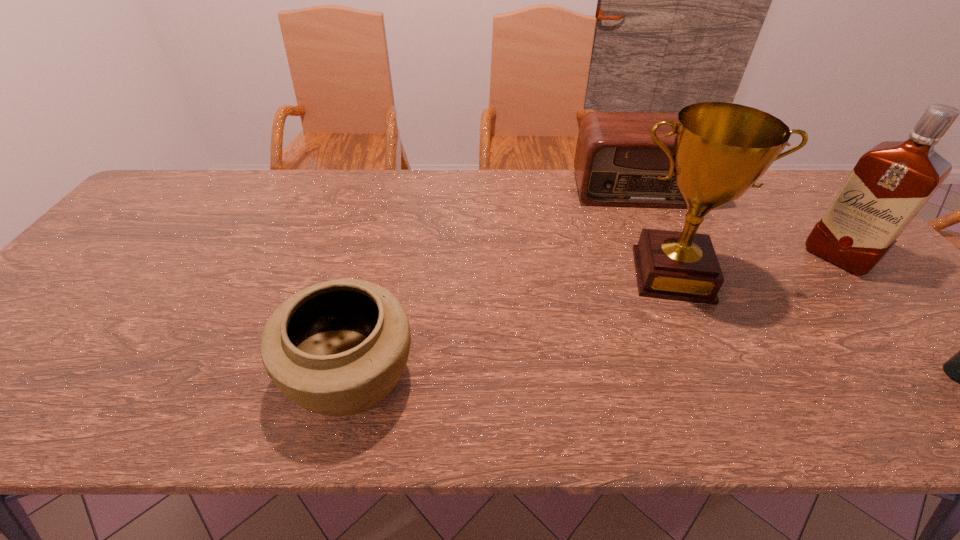
Where is `vacant space at the right edge of the desktop`? This screenshot has height=540, width=960. vacant space at the right edge of the desktop is located at coordinates (913, 343).

At what (x,y) coordinates should I click in order to perform the action: click on empty location between the award and the leftmost object. Please return your answer as a coordinate pair (x, y). Image resolution: width=960 pixels, height=540 pixels. Looking at the image, I should click on (512, 325).

Find the location of a particular element. empty location between the pottery and the liquor is located at coordinates (595, 316).

Where is `vacant space that's between the liquor and the farthest object`? This screenshot has width=960, height=540. vacant space that's between the liquor and the farthest object is located at coordinates (738, 224).

In order to click on empty space that is in between the leftmost object and the award in this screenshot , I will do `click(512, 325)`.

At what (x,y) coordinates should I click in order to perform the action: click on vacant area that lies between the radio receiver and the leftmost object. Please return your answer as a coordinate pair (x, y). This screenshot has height=540, width=960. Looking at the image, I should click on (495, 283).

Identify the location of free spot between the award and the pottery. (512, 325).

Identify which object is the third nearest to the vodka. Please provide its 2D coordinates. Your answer should be formatted as a tuple, i.e. [(x, y)], where the tuple contains the x and y coordinates of a point satisfying the conditions above.

[(617, 163)]

Find the location of a particular element. Image resolution: width=960 pixels, height=540 pixels. object that stands as the closest to the award is located at coordinates (617, 163).

I want to click on free location that satisfies the following two spatial constraints: 1. on the back side of the liquor; 2. on the left side of the pottery, so click(x=381, y=258).